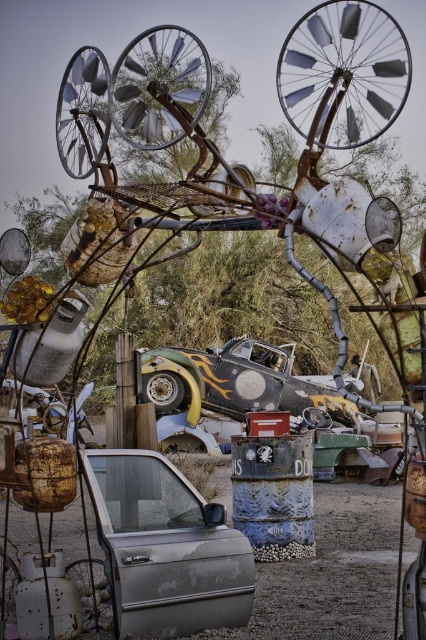
Question: Which object appears closest to the camera in this image?

Choices:
 (A) silver metallic car door at center
 (B) painted metal car at center

Answer: (A)

Question: Does silver metallic car door at center come behind painted metal car at center?

Choices:
 (A) yes
 (B) no

Answer: (B)

Question: Among these points, which one is farthest from the camera?

Choices:
 (A) (261, 346)
 (B) (112, 547)

Answer: (A)

Question: Where is silver metallic car door at center located in relation to painted metal car at center in the image?

Choices:
 (A) left
 (B) right

Answer: (B)

Question: Does silver metallic car door at center have a smaller size compared to painted metal car at center?

Choices:
 (A) yes
 (B) no

Answer: (B)